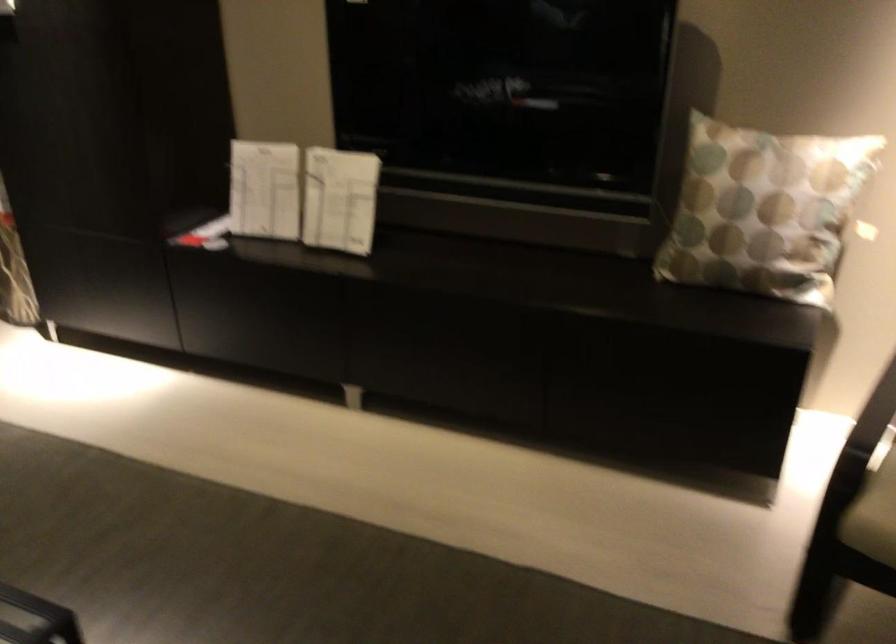
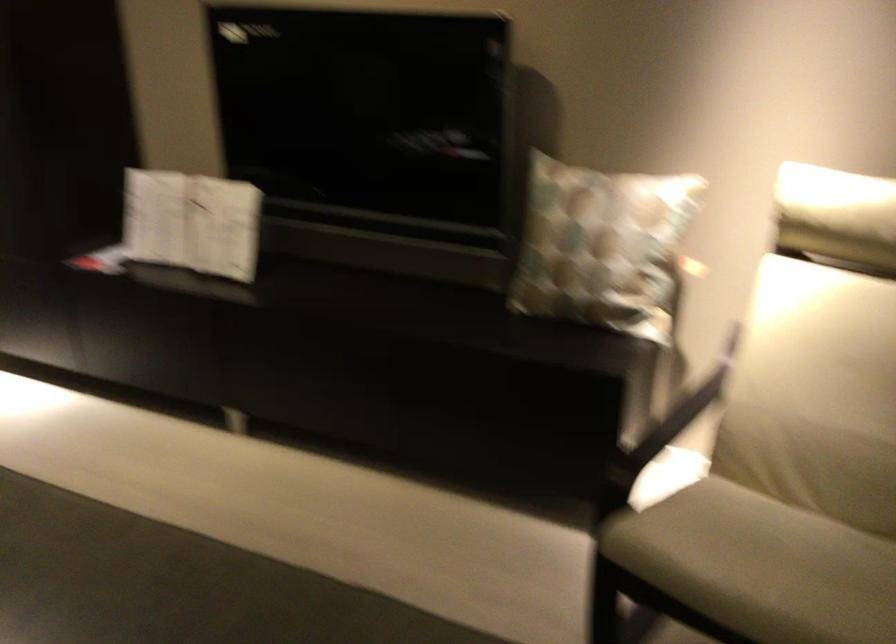
Question: The images are taken continuously from a first-person perspective. In which direction is your viewpoint rotating?

Choices:
 (A) Left
 (B) Right
 (C) Up
 (D) Down

Answer: (C)